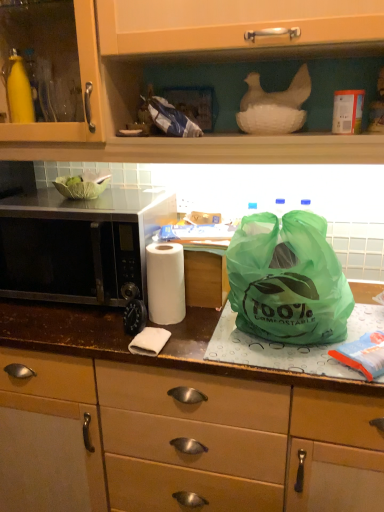
What are the coordinates of `free spot in front of white matte paper towel at center` in the screenshot? It's located at (188, 348).